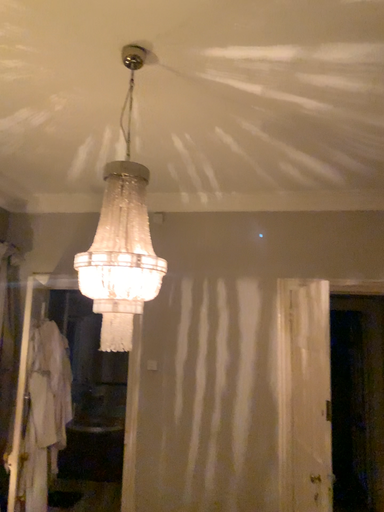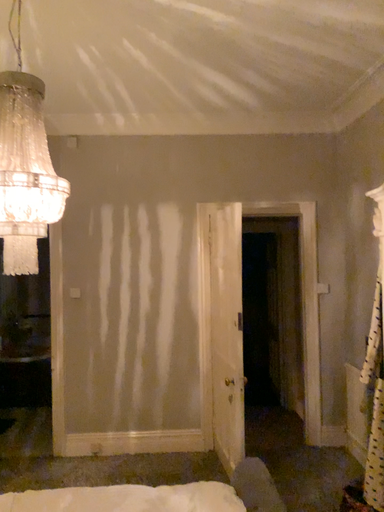
Question: How did the camera likely rotate when shooting the video?

Choices:
 (A) rotated downward
 (B) rotated upward

Answer: (A)